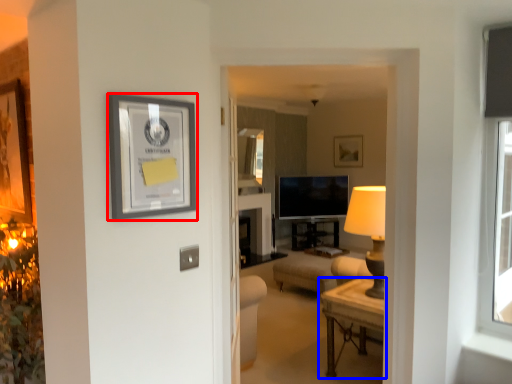
Question: Among these objects, which one is nearest to the camera, picture frame (highlighted by a red box) or table (highlighted by a blue box)?

Choices:
 (A) picture frame
 (B) table

Answer: (A)